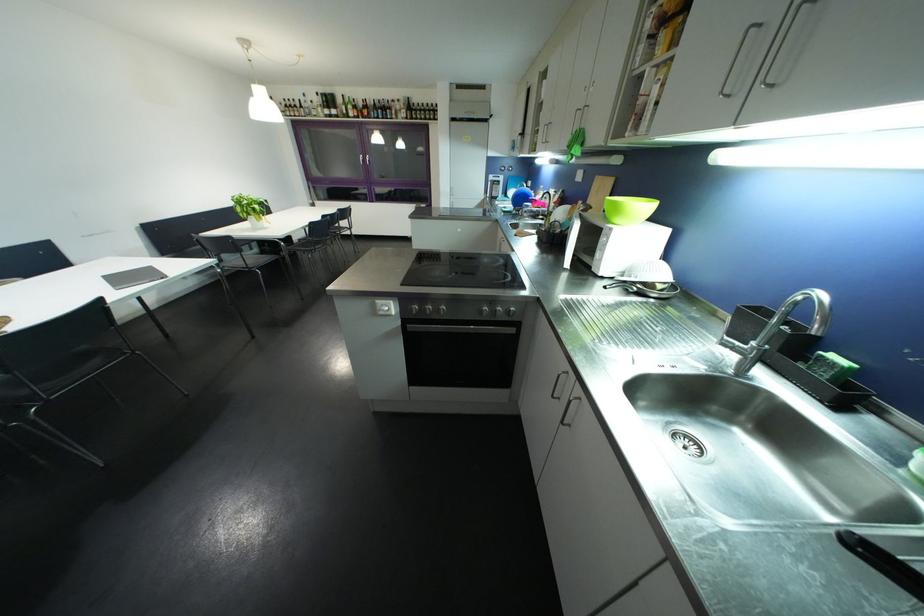
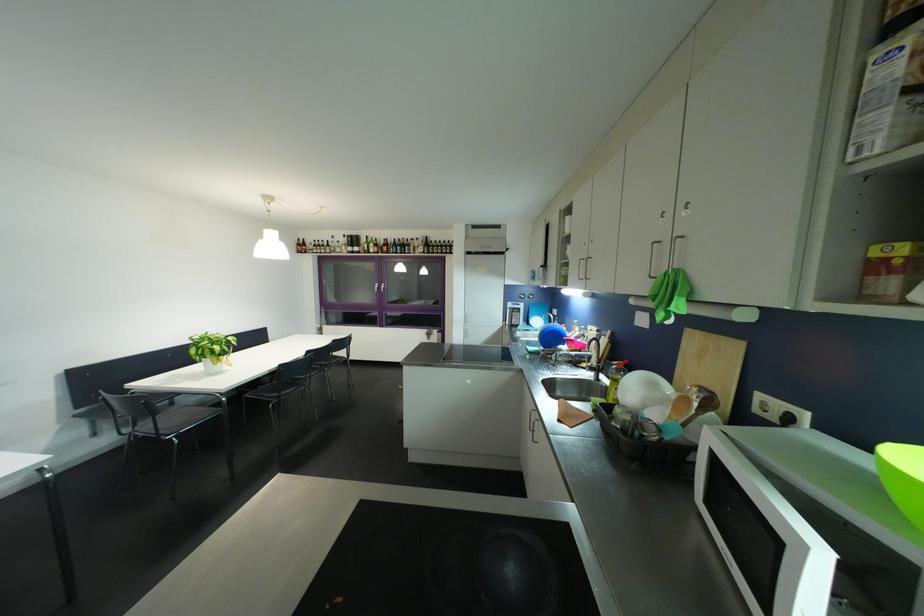
Question: The first image is from the beginning of the video and the second image is from the end. How did the camera likely rotate when shooting the video?

Choices:
 (A) Left
 (B) Right
 (C) Up
 (D) Down

Answer: (C)